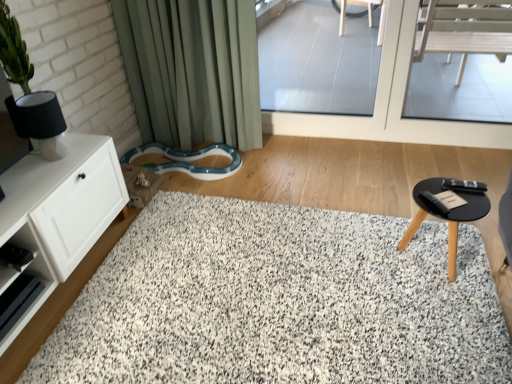
Locate an element on the screen. The width and height of the screenshot is (512, 384). vacant area to the left of black matte lampshade at upper left is located at coordinates (19, 162).